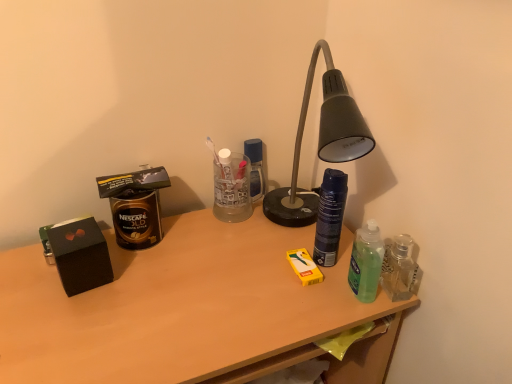
Find the location of a particular element. The width and height of the screenshot is (512, 384). vacant space in between green translucent bottle at right, which is the first bottle in right-to-left order, and gold matte canister at left is located at coordinates pos(232,254).